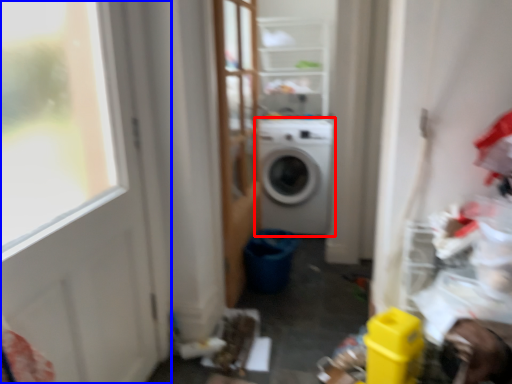
Question: Which point is closer to the camera, washing machine (highlighted by a red box) or door (highlighted by a blue box)?

Choices:
 (A) washing machine
 (B) door

Answer: (B)